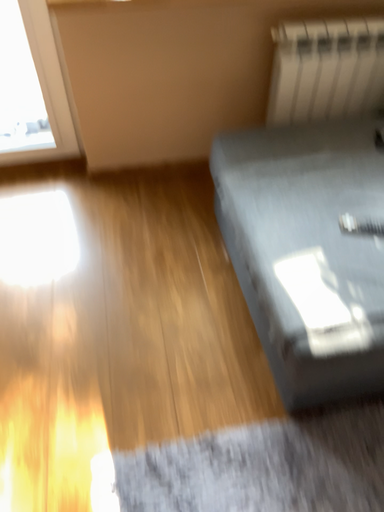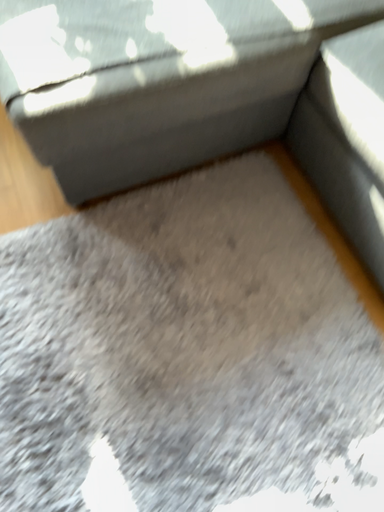
Question: How did the camera likely rotate when shooting the video?

Choices:
 (A) rotated left
 (B) rotated right

Answer: (B)